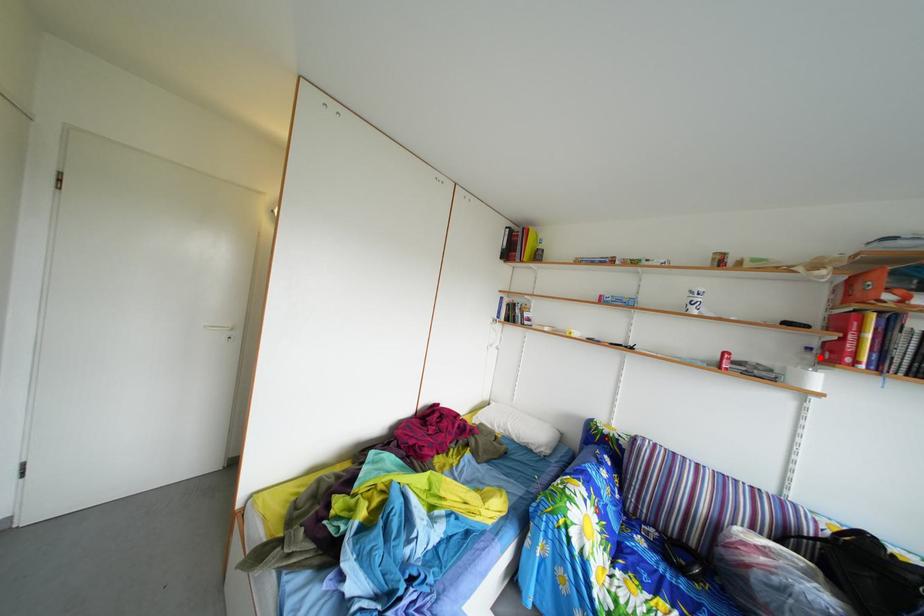
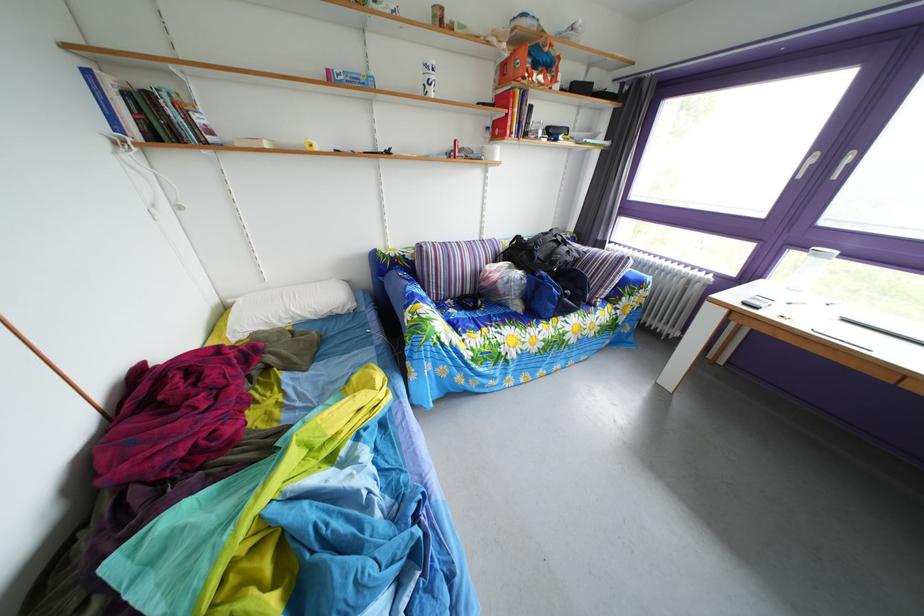
In the second image, find the point that corresponds to the highlighted location in the first image.

(499, 137)